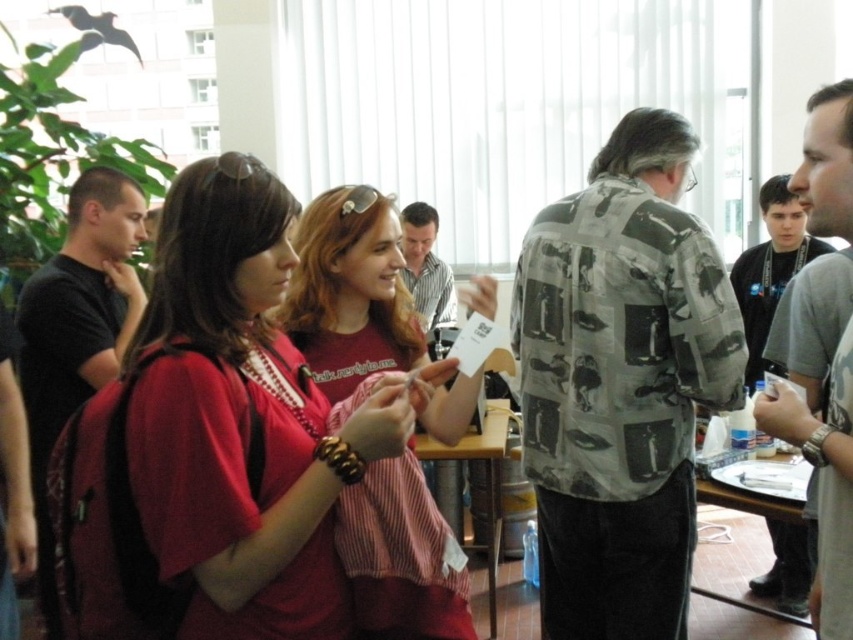
You are organizing a photo shoot and need to arrange two models wearing the printed camouflage shirt at center and the matte red shirt at center. Based on the scene description, which model should stand closer to the camera to ensure both appear equally wide in the photo?

The printed camouflage shirt at center might be wider than matte red shirt at center, so the printed camouflage shirt at center should be placed slightly farther from the camera to balance their apparent widths.

You are organizing a photo shoot and need to ensure that the matte red shirt at center and the light brown striped shirt at center are visible in the frame. Given their sizes, which shirt should you focus on to ensure it doesn,t get cropped out?

The matte red shirt at center is larger in size than the light brown striped shirt at center, so you should focus on ensuring the matte red shirt at center is fully visible to prevent cropping.

You are organizing a photo shoot and need to ensure that all participants are visible in the frame. Given that the printed camouflage shirt at center and the matte red shirt at center are both in focus, which shirt should you adjust to make sure both are clearly visible?

The printed camouflage shirt at center is bigger than the matte red shirt at center, so you should adjust the focus or camera angle to ensure both shirts are in clear view, prioritizing the larger printed camouflage shirt at center to maintain balance.